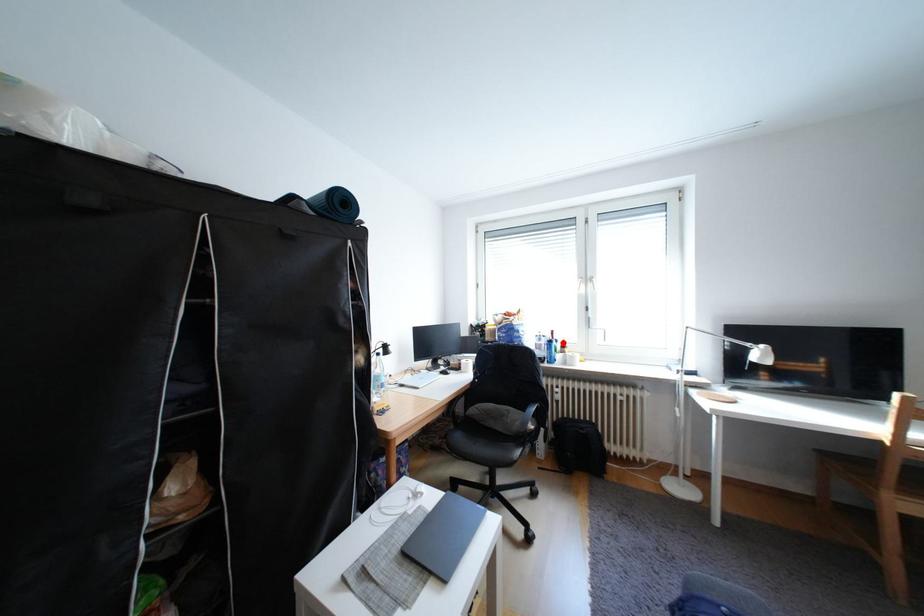
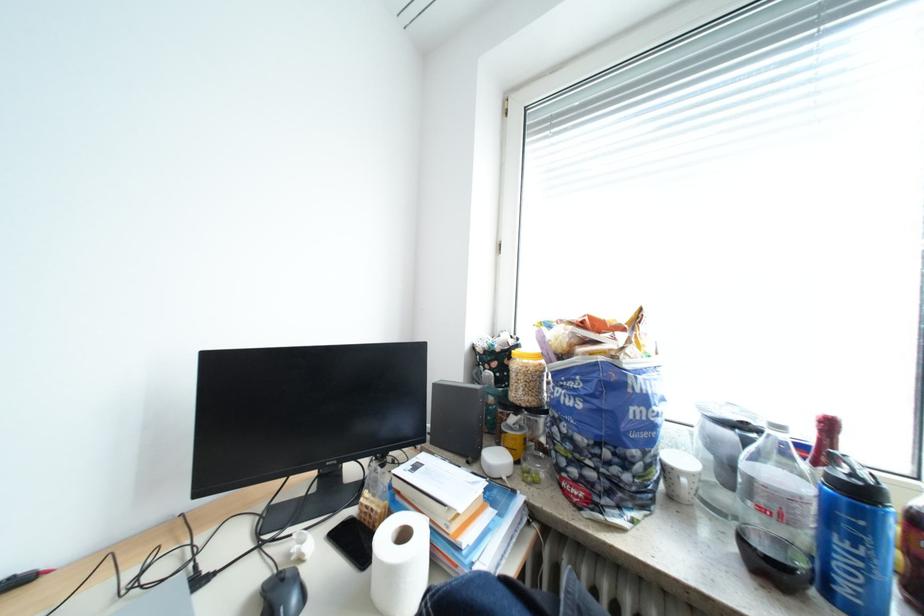
Question: I am providing you with two images of the same scene from different viewpoints. Image1 has a red point marked. In image2, the corresponding 3D location appears at what relative position? Reply with the corresponding letter.

Choices:
 (A) Closer
 (B) Farther

Answer: (A)